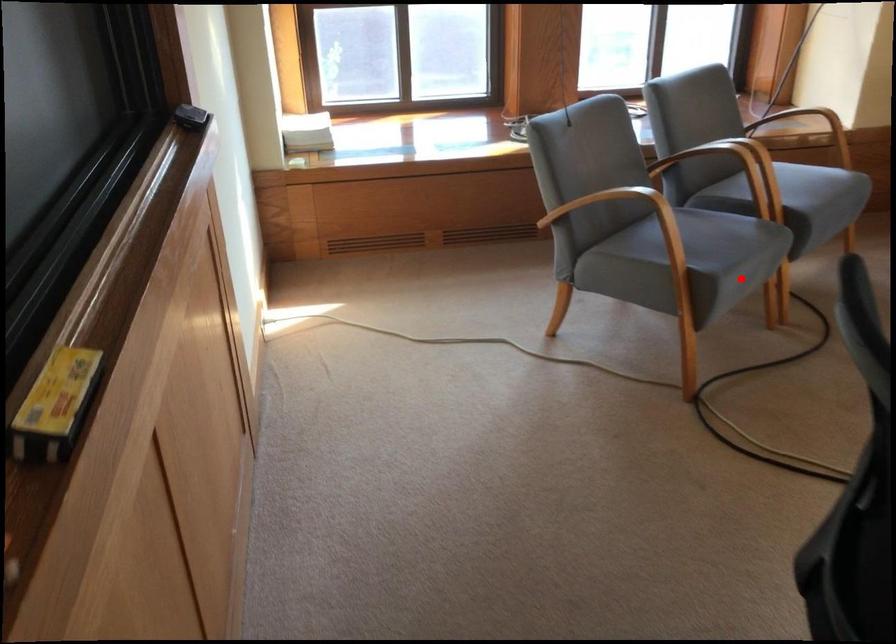
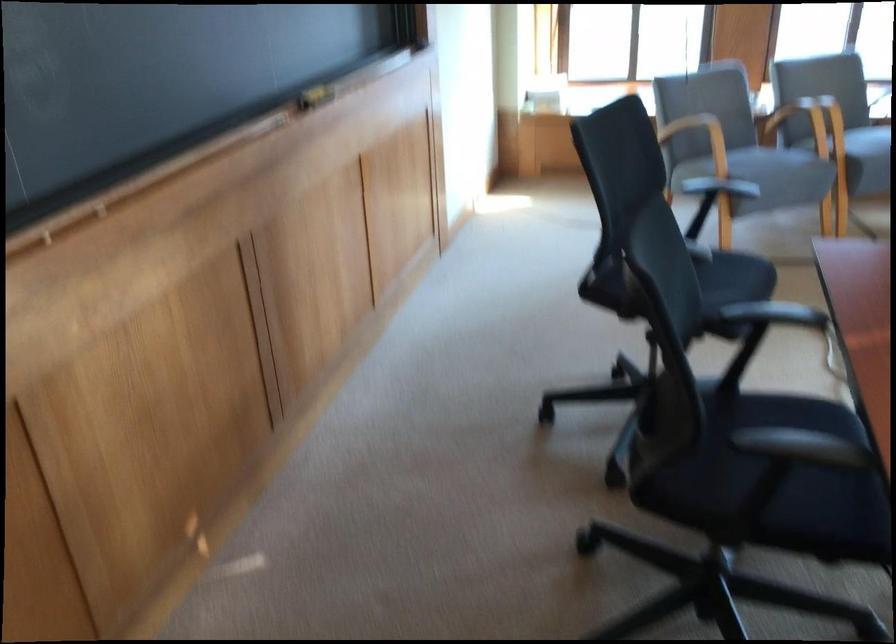
Question: I am providing you with two images of the same scene from different viewpoints. Image1 has a red point marked. In image2, the corresponding 3D location appears at what relative position? Reply with the corresponding letter.

Choices:
 (A) Closer
 (B) Farther

Answer: (B)